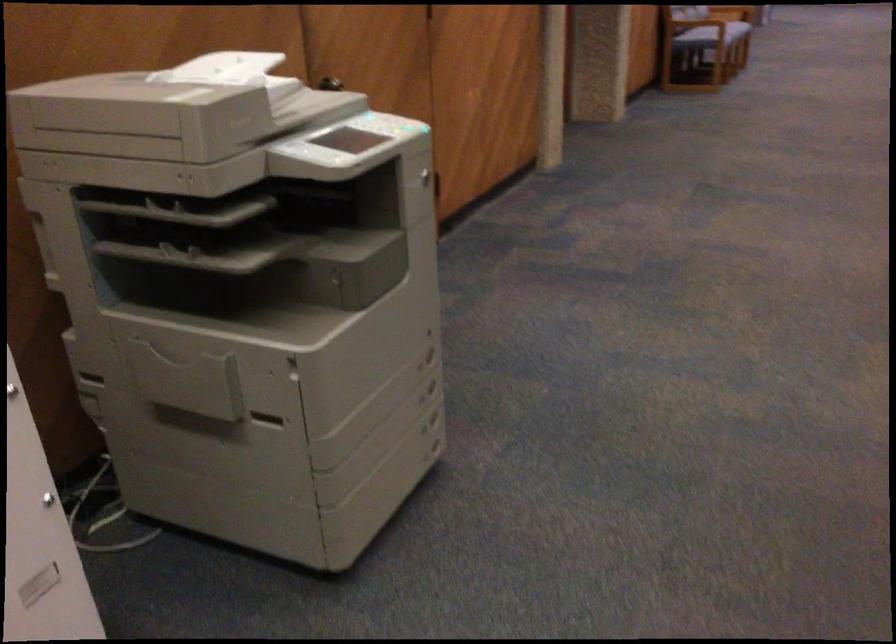
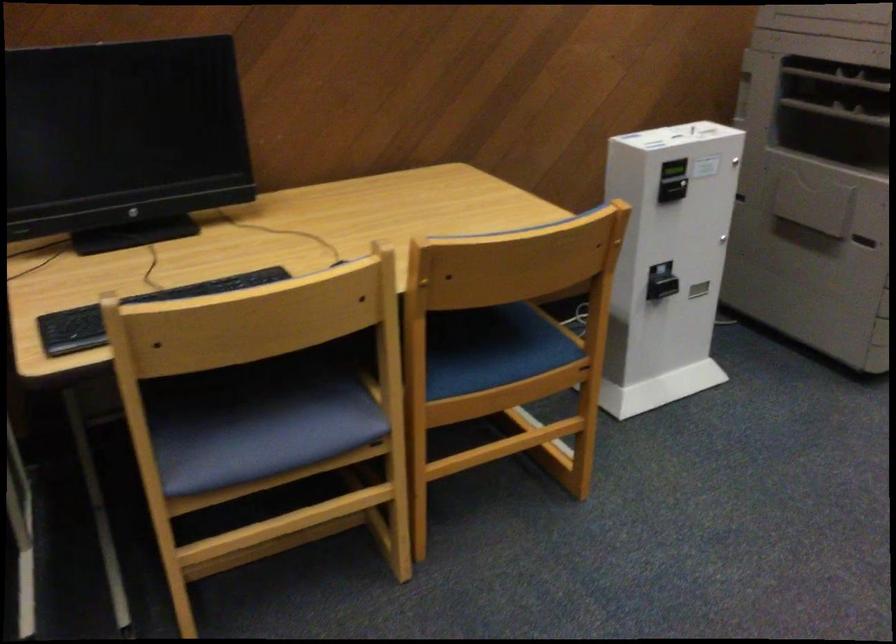
In the second image, find the point that corresponds to point 153,228 in the first image.

(839, 79)